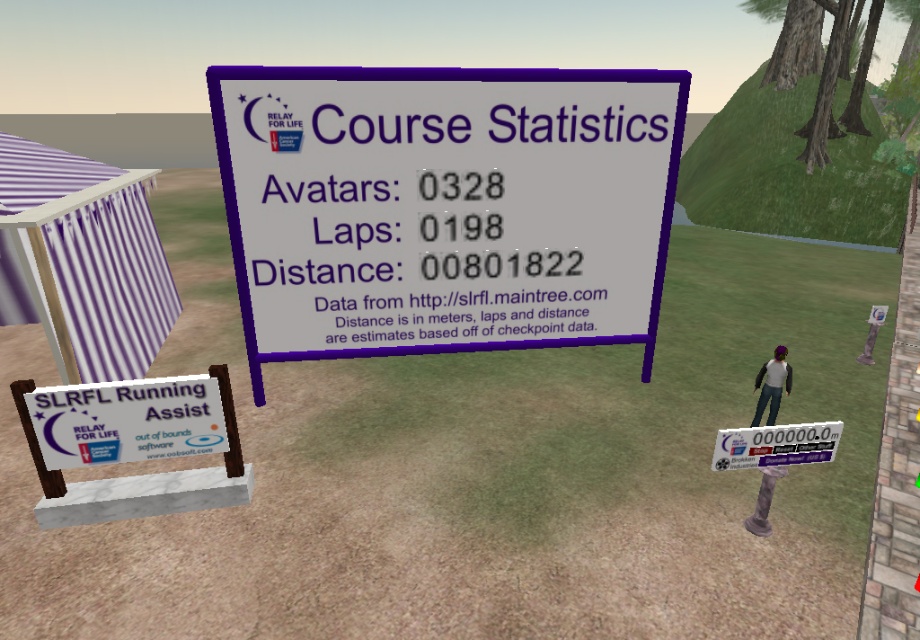
Does white paper sign at center have a lesser height compared to purple striped canopy at left?

No, white paper sign at center is not shorter than purple striped canopy at left.

Does white paper sign at center come in front of purple striped canopy at left?

Yes, it is in front of purple striped canopy at left.

I want to click on white paper sign at center, so click(x=445, y=205).

I want to click on white paper sign at center, so click(x=445, y=205).

Between point (31, 269) and point (780, 390), which one is positioned behind?

The point (780, 390) is more distant.

The height and width of the screenshot is (640, 920). What do you see at coordinates (82, 259) in the screenshot?
I see `purple striped canopy at left` at bounding box center [82, 259].

Identify the location of purple striped canopy at left. (82, 259).

Does purple glossy sign at center have a lesser height compared to denim jeans at center?

Correct, purple glossy sign at center is not as tall as denim jeans at center.

Does purple glossy sign at center have a smaller size compared to denim jeans at center?

Correct, purple glossy sign at center occupies less space than denim jeans at center.

Find the location of a particular element. purple glossy sign at center is located at coordinates (775, 444).